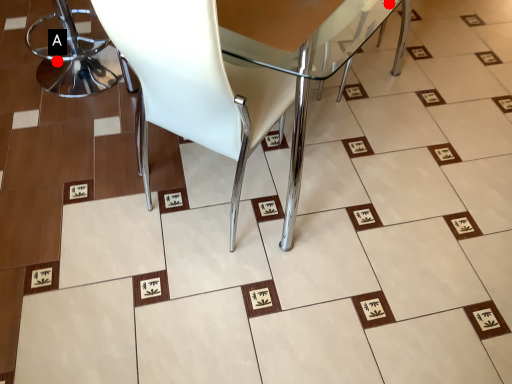
Question: Two points are circled on the image, labeled by A and B beside each circle. Which of the following is the farthest from the observer?

Choices:
 (A) A is further
 (B) B is further

Answer: (B)